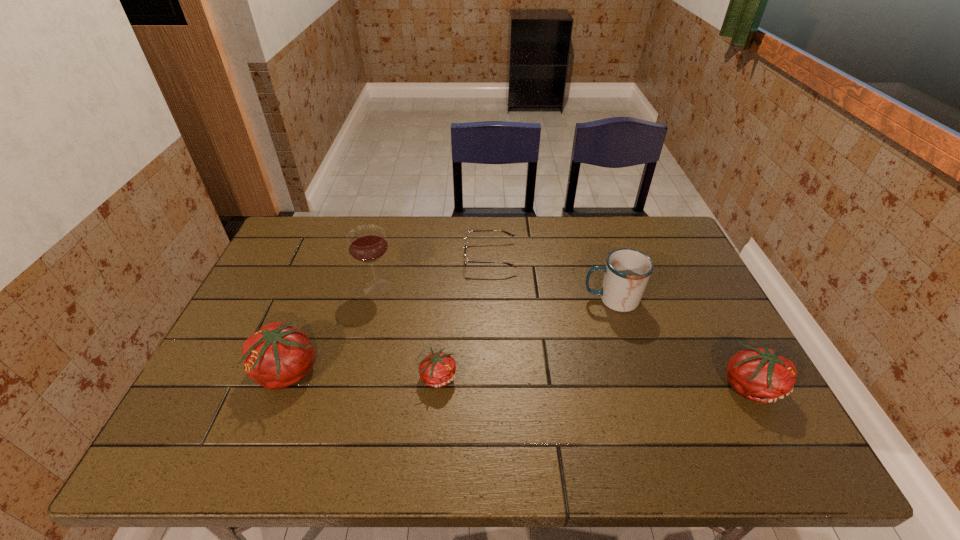
The width and height of the screenshot is (960, 540). I want to click on the leftmost tomato, so (x=277, y=356).

In order to click on the second tomato from right to left in this screenshot , I will do `click(438, 369)`.

At what (x,y) coordinates should I click in order to perform the action: click on the shortest tomato. Please return your answer as a coordinate pair (x, y). The image size is (960, 540). Looking at the image, I should click on (438, 369).

Where is `the fourth tallest object`? the fourth tallest object is located at coordinates (762, 375).

Where is `the rightmost object`? the rightmost object is located at coordinates (762, 375).

The height and width of the screenshot is (540, 960). I want to click on spectacles, so click(x=466, y=261).

Identify the location of the farthest object. Image resolution: width=960 pixels, height=540 pixels. (466, 261).

Find the location of `wineglass`. wineglass is located at coordinates (367, 243).

The width and height of the screenshot is (960, 540). Find the location of `the tallest object`. the tallest object is located at coordinates click(367, 243).

The height and width of the screenshot is (540, 960). I want to click on the fifth object from left to right, so click(627, 271).